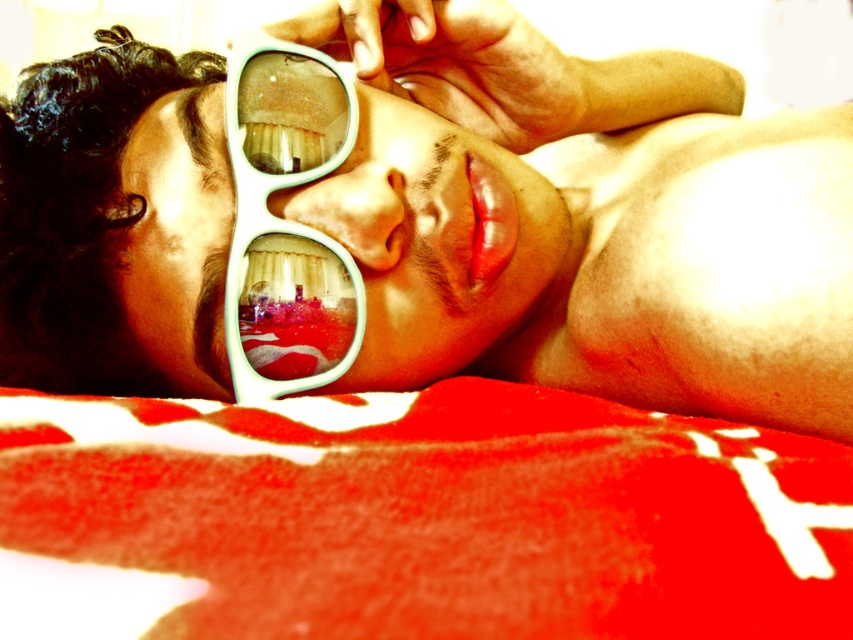
Question: Can you confirm if red fuzzy blanket at lower center is bigger than teal plastic goggles at center?

Choices:
 (A) yes
 (B) no

Answer: (A)

Question: Which point appears closest to the camera in this image?

Choices:
 (A) [842, 534]
 (B) [405, 234]
 (C) [79, 228]
 (D) [258, 124]

Answer: (A)

Question: Among these objects, which one is nearest to the camera?

Choices:
 (A) matte plastic sunglasses at upper center
 (B) teal plastic sunglasses at center

Answer: (A)

Question: Which object appears closest to the camera in this image?

Choices:
 (A) teal plastic sunglasses at center
 (B) red fuzzy blanket at lower center
 (C) teal plastic goggles at center
 (D) matte plastic sunglasses at upper center

Answer: (B)

Question: Can you confirm if red fuzzy blanket at lower center is positioned above teal plastic sunglasses at center?

Choices:
 (A) no
 (B) yes

Answer: (A)

Question: Can you confirm if matte plastic sunglasses at upper center is smaller than red fuzzy blanket at lower center?

Choices:
 (A) yes
 (B) no

Answer: (B)